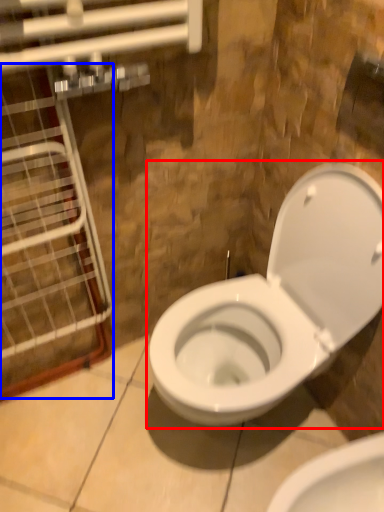
Question: Which object appears farthest to the camera in this image, toilet (highlighted by a red box) or glass door (highlighted by a blue box)?

Choices:
 (A) toilet
 (B) glass door

Answer: (A)